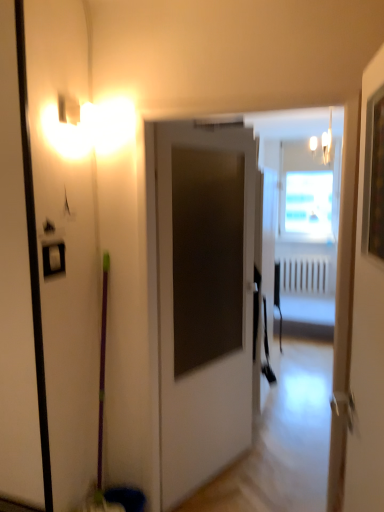
Question: Considering their positions, is white matte door at center, the 2th door viewed from the front, located in front of or behind white glossy door at upper right, which is counted as the 2th door, starting from the back?

Choices:
 (A) front
 (B) behind

Answer: (B)

Question: Is white matte door at center, marked as the 1th door in a back-to-front arrangement, wider or thinner than white glossy door at upper right, the first door positioned from the front?

Choices:
 (A) thin
 (B) wide

Answer: (B)

Question: Which object is the farthest from the white matte door at center, marked as the 1th door in a back-to-front arrangement?

Choices:
 (A) white plastic radiator at center
 (B) white glossy door at upper right, which is counted as the 2th door, starting from the back

Answer: (A)

Question: Which of these objects is positioned farthest from the white plastic radiator at center?

Choices:
 (A) white glossy door at upper right, the first door positioned from the front
 (B) white matte door at center, marked as the 1th door in a back-to-front arrangement

Answer: (A)